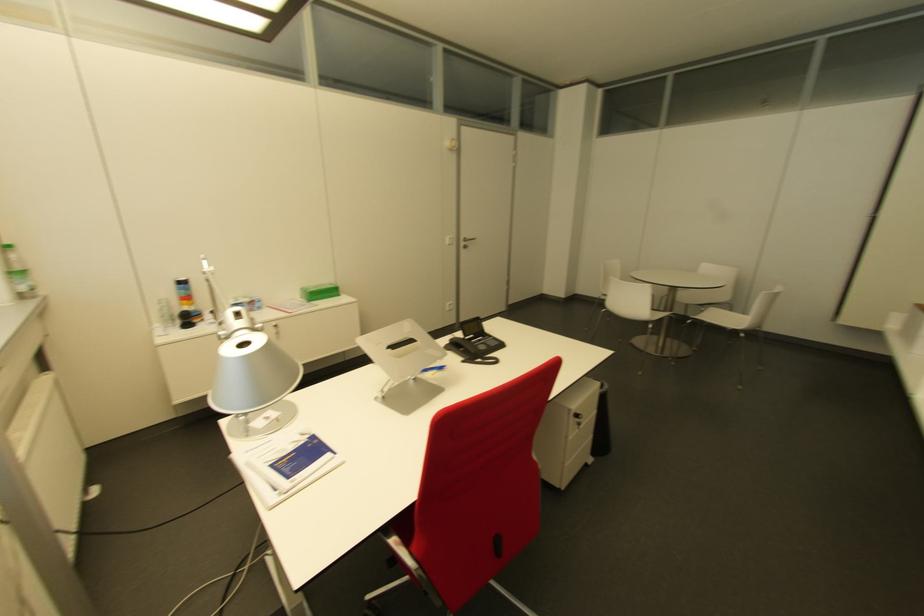
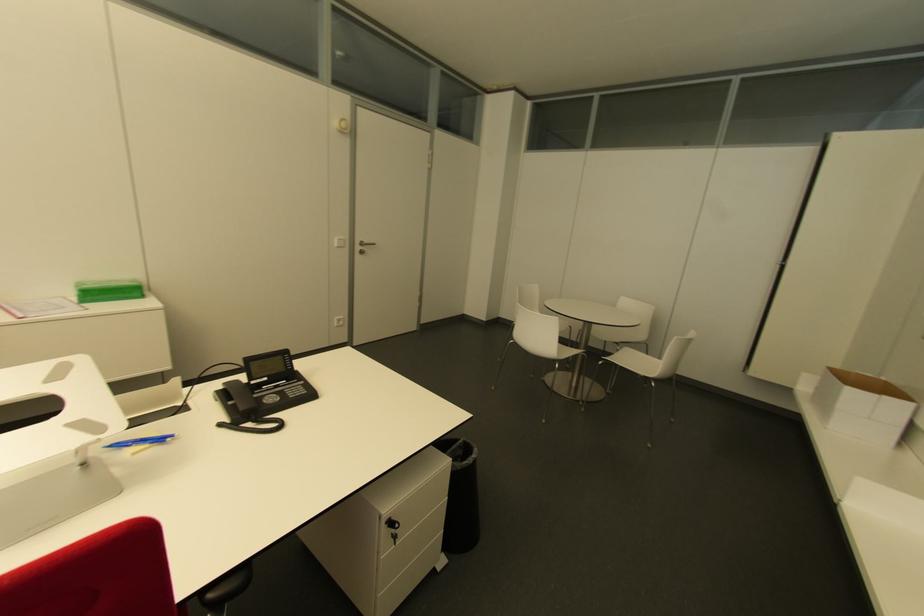
Where in the second image is the point corresponding to [490,338] from the first image?

(299, 383)